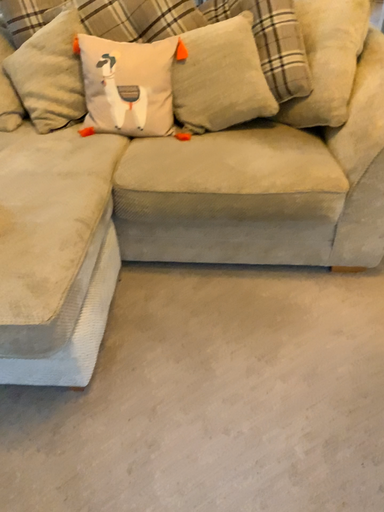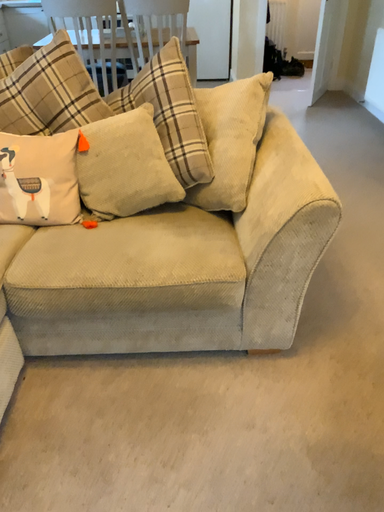
Question: Which way did the camera rotate in the video?

Choices:
 (A) rotated upward
 (B) rotated downward

Answer: (A)